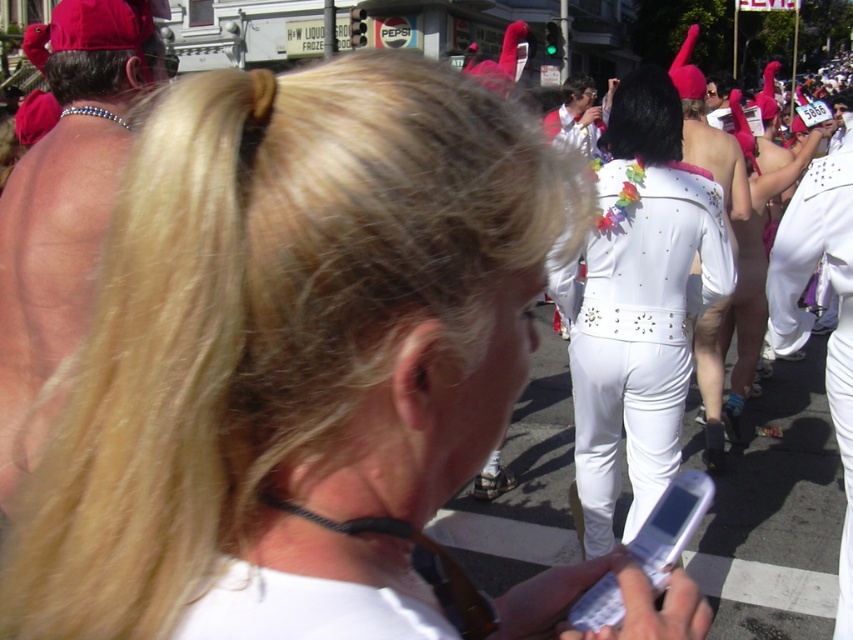
You are a photographer trying to capture both the white shiny jumpsuit at center and the white plastic phone at center in a single frame. Which object should you focus on first to ensure both are in the frame?

You should focus on the white shiny jumpsuit at center first because it is larger in size than the white plastic phone at center, making it easier to position within the frame while still allowing space for the smaller object.

You are a photographer trying to capture the white shiny jumpsuit at center and the white plastic phone at center in the same frame. Which object should you focus on first to ensure both are in focus?

You should focus on the white shiny jumpsuit at center first because the white plastic phone at center is behind it, so adjusting focus starting from the closer object will help both be in focus.